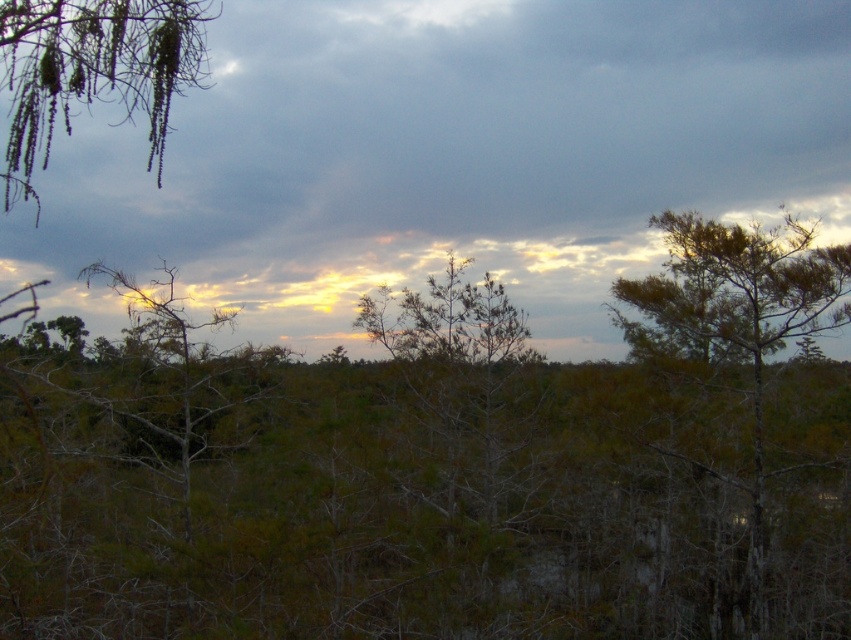
Question: Based on their relative distances, which object is nearer to the green matte tree at center?

Choices:
 (A) green matte hanging branches at upper left
 (B) green textured tree at center
 (C) cloudy sky at upper center

Answer: (B)

Question: Does green matte tree at center have a larger size compared to cloudy sky at upper center?

Choices:
 (A) yes
 (B) no

Answer: (B)

Question: Can you confirm if green matte tree at center is wider than green textured tree at right?

Choices:
 (A) no
 (B) yes

Answer: (B)

Question: Which of the following is the closest to the observer?

Choices:
 (A) cloudy sky at upper center
 (B) green matte tree at center

Answer: (A)

Question: Is green matte hanging branches at upper left positioned at the back of green textured tree at right?

Choices:
 (A) no
 (B) yes

Answer: (A)

Question: Which point is farther from the camera taking this photo?

Choices:
 (A) (585, 252)
 (B) (455, 506)
 (C) (714, 244)
 (D) (398, 460)

Answer: (A)